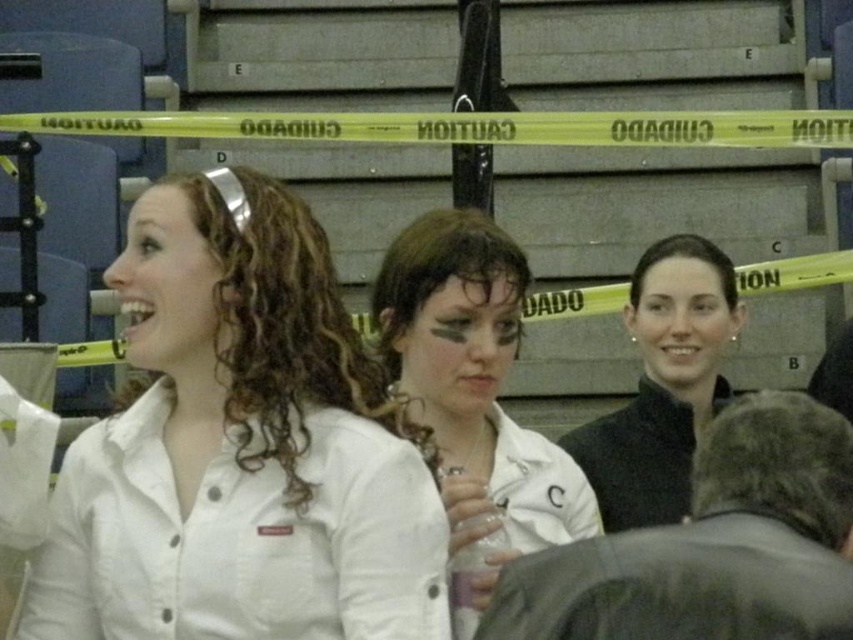
You are attending an event in the stadium and need to locate the person wearing the white matte shirt at upper left. According to the scene description, where exactly is this person positioned relative to the yellow caution tape?

The white matte shirt at upper left is located at point (239, 449), which is to the upper left of the yellow caution tape in the seating area.

You are a photographer trying to capture a candid shot of the white matte shirt at upper left and the black matte jacket at center. Since you want to ensure both subjects are in focus, you need to know which one is wider. Which clothing item has a greater width?

The white matte shirt at upper left has a greater width than the black matte jacket at center.